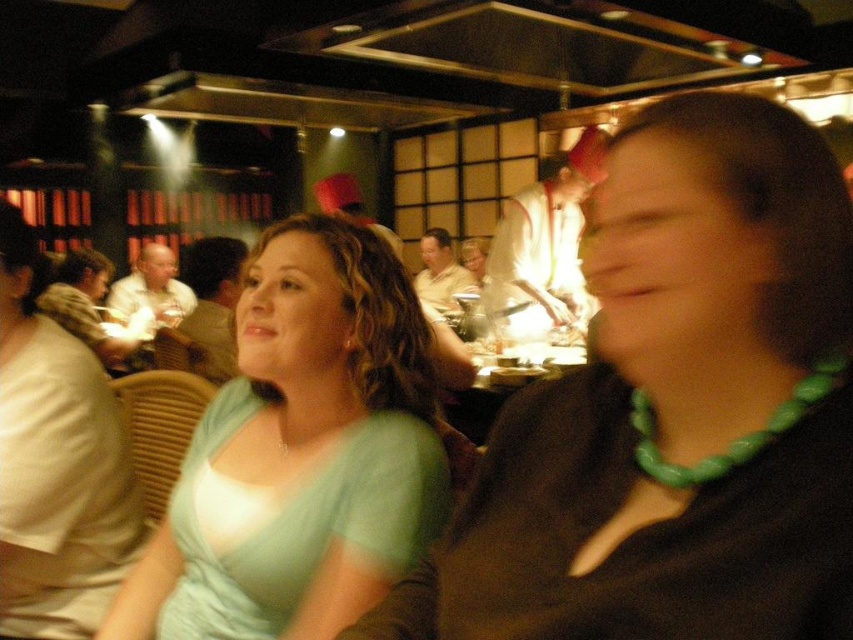
Which is below, white glossy chef at center or matte black chef hat at center?

white glossy chef at center is lower down.

Is white glossy chef at center above matte black chef hat at center?

No, white glossy chef at center is not above matte black chef hat at center.

You are a GUI agent. You are given a task and a screenshot of the screen. Output one action in this format:
    pyautogui.click(x=<x>, y=<y>)
    Task: Click on the white glossy chef at center
    The height and width of the screenshot is (640, 853).
    Given the screenshot: What is the action you would take?
    pyautogui.click(x=544, y=248)

Locate an element on the screen. The image size is (853, 640). white glossy chef at center is located at coordinates (544, 248).

Can you confirm if white glossy chef at center is positioned to the right of white shirt at center?

Correct, you'll find white glossy chef at center to the right of white shirt at center.

Between white glossy chef at center and white shirt at center, which one appears on the left side from the viewer's perspective?

white shirt at center

Which is behind, point (523, 328) or point (177, 312)?

Point (177, 312)

Identify the location of white glossy chef at center. (544, 248).

Between light green fabric dress at upper left and white shirt at center, which one appears on the left side from the viewer's perspective?

white shirt at center is more to the left.

Which is in front, point (80, 513) or point (163, 321)?

Positioned in front is point (80, 513).

Find the location of a particular element. The height and width of the screenshot is (640, 853). light green fabric dress at upper left is located at coordinates (56, 465).